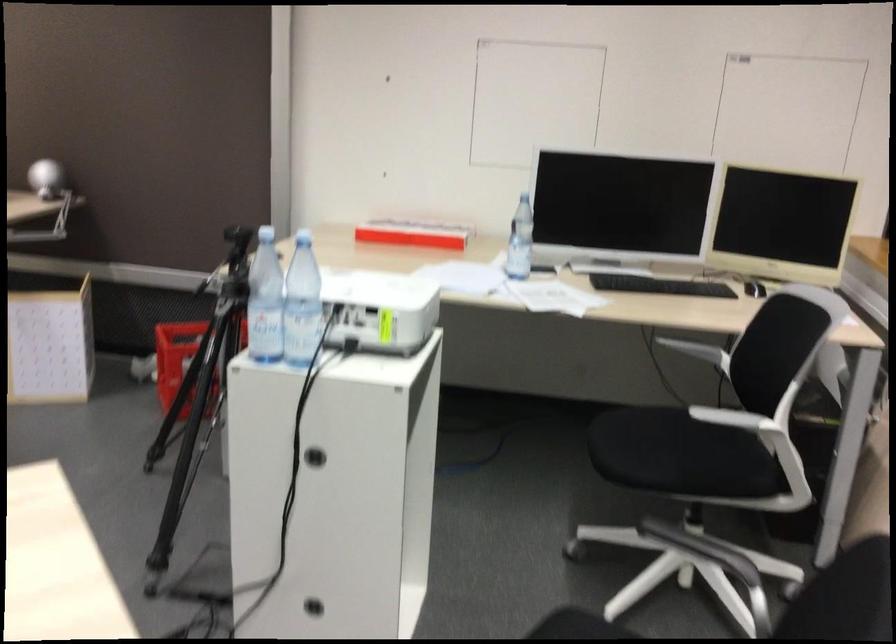
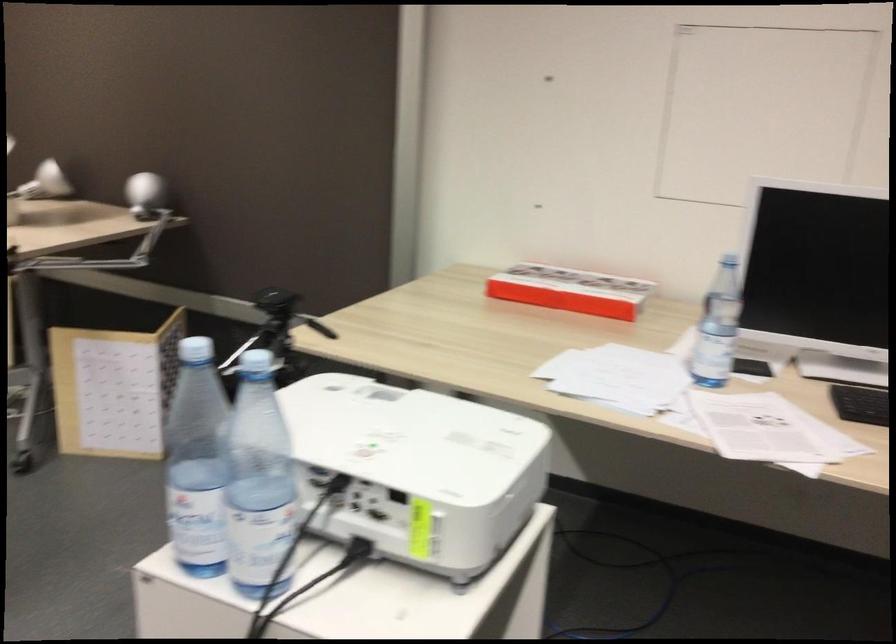
Where in the second image is the point corresponding to point (280, 310) from the first image?

(259, 482)